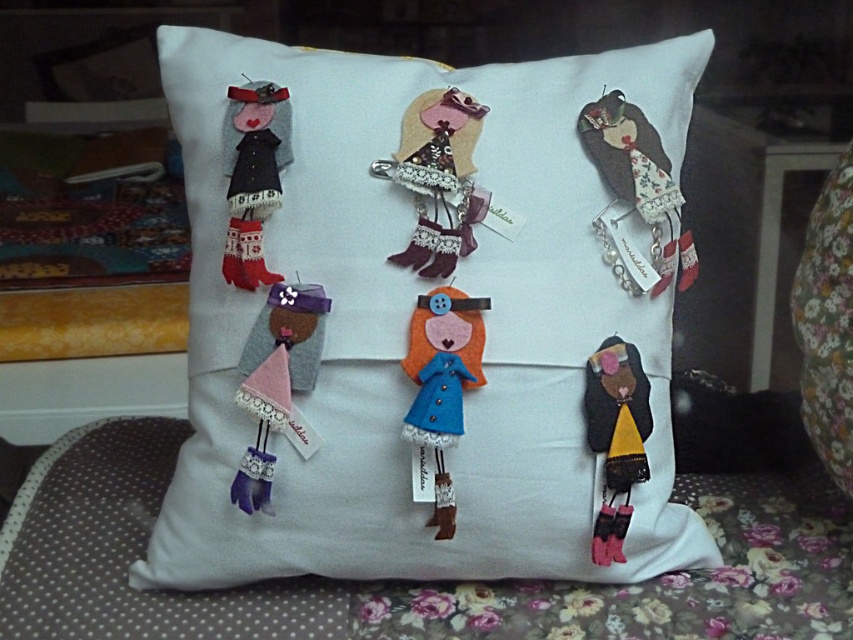
Is pink felt doll at center shorter than blue felt doll at center?

Correct, pink felt doll at center is not as tall as blue felt doll at center.

Consider the image. How distant is pink felt doll at center from blue felt doll at center?

3.28 inches

What are the coordinates of `pink felt doll at center` in the screenshot? It's located at (276, 380).

Locate an element on the screen. brown felt doll at upper right is located at coordinates (636, 196).

Does brown felt doll at upper right appear over blue felt doll at center?

Correct, brown felt doll at upper right is located above blue felt doll at center.

What do you see at coordinates (636, 196) in the screenshot?
I see `brown felt doll at upper right` at bounding box center [636, 196].

The image size is (853, 640). Find the location of `brown felt doll at upper right`. brown felt doll at upper right is located at coordinates 636,196.

Is white felt pillow at center thinner than blue felt doll at center?

No, white felt pillow at center is not thinner than blue felt doll at center.

You are a GUI agent. You are given a task and a screenshot of the screen. Output one action in this format:
    pyautogui.click(x=<x>, y=<y>)
    Task: Click on the white felt pillow at center
    This screenshot has height=640, width=853.
    Given the screenshot: What is the action you would take?
    pyautogui.click(x=430, y=316)

Which is in front, point (509, 192) or point (451, 500)?

Point (451, 500) is more forward.

Find the location of a particular element. white felt pillow at center is located at coordinates (430, 316).